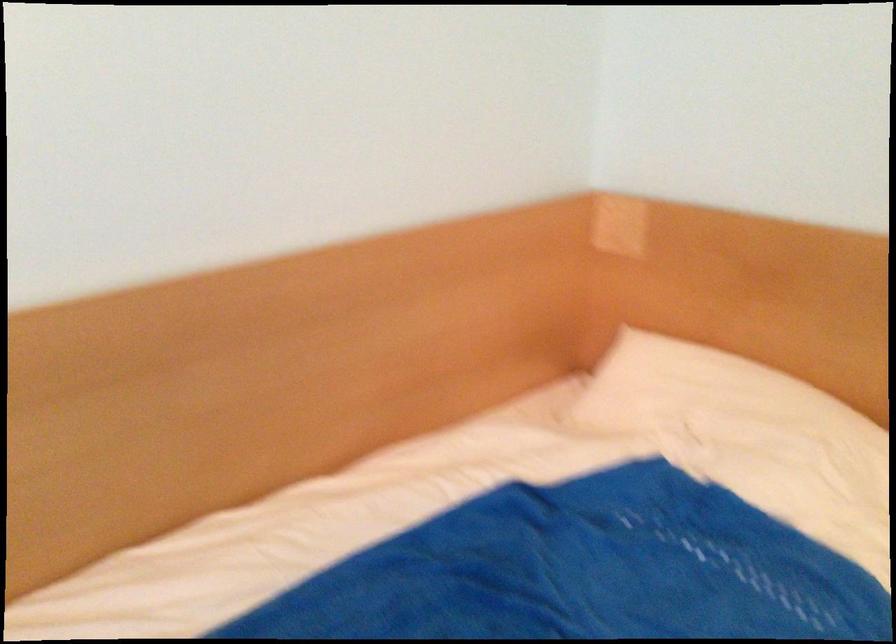
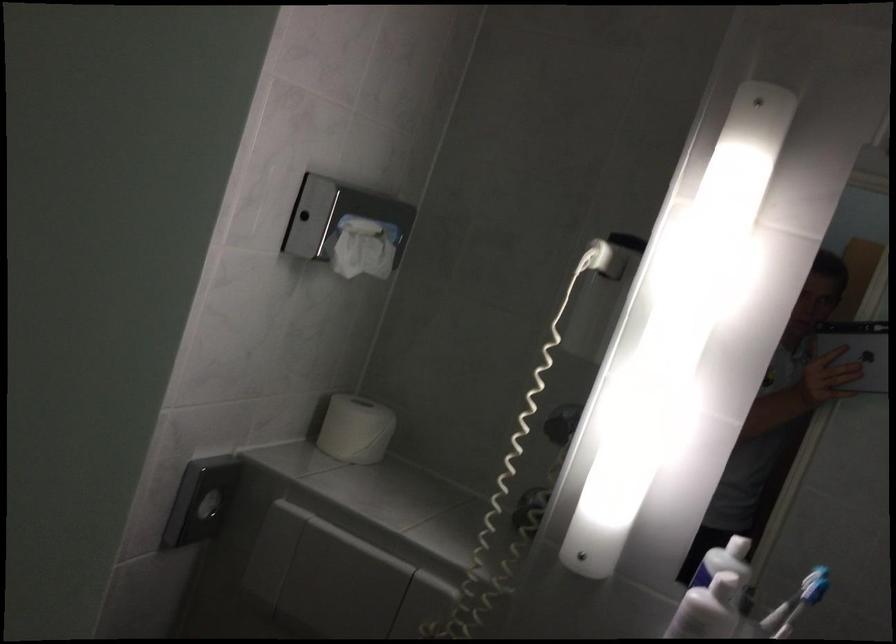
Where in the second image is the point corresponding to point (718, 84) from the first image?

(355, 429)